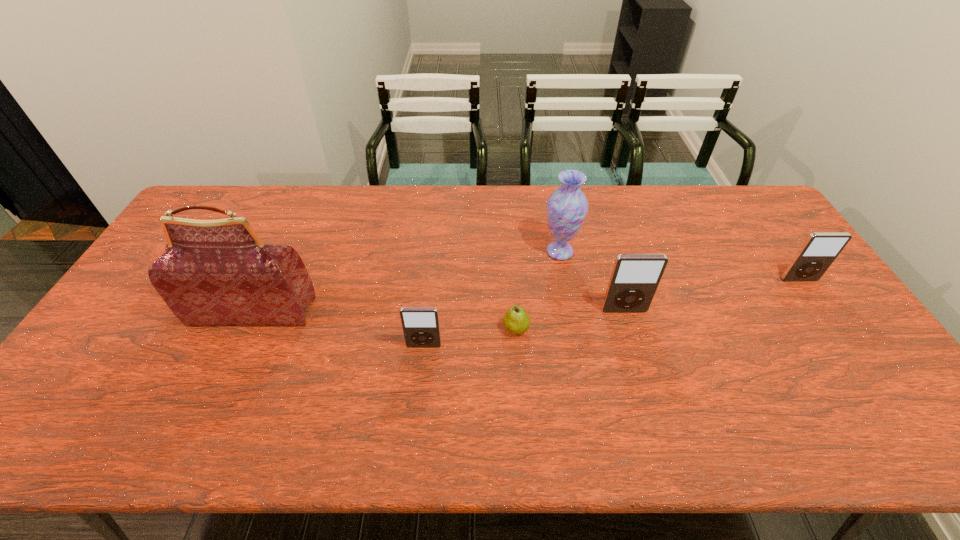
At what (x,y) coordinates should I click in order to perform the action: click on the third object from left to right. Please return your answer as a coordinate pair (x, y). The width and height of the screenshot is (960, 540). Looking at the image, I should click on (516, 320).

At what (x,y) coordinates should I click in order to perform the action: click on the shortest object. Please return your answer as a coordinate pair (x, y). This screenshot has width=960, height=540. Looking at the image, I should click on (516, 320).

Locate an element on the screen. This screenshot has height=540, width=960. vacant space located on the front-facing side of the fifth object from right to left is located at coordinates coord(420,382).

Find the location of `free space located 0.220m on the front-facing side of the second nearest iPod`. free space located 0.220m on the front-facing side of the second nearest iPod is located at coordinates (645, 384).

Identify the location of free space located 0.130m on the front-facing side of the rightmost object. Image resolution: width=960 pixels, height=540 pixels. (825, 316).

In order to click on free space located 0.130m on the front-facing side of the tallest object in this screenshot , I will do `click(227, 369)`.

The image size is (960, 540). I want to click on free space located 0.390m on the left of the fourth object from left to right, so click(x=418, y=251).

Find the location of `vacant space situated on the left of the pear`. vacant space situated on the left of the pear is located at coordinates (450, 328).

Find the location of a particular element. This screenshot has height=540, width=960. object at the right edge is located at coordinates (820, 249).

Locate an element on the screen. vacant space at the far edge is located at coordinates (472, 215).